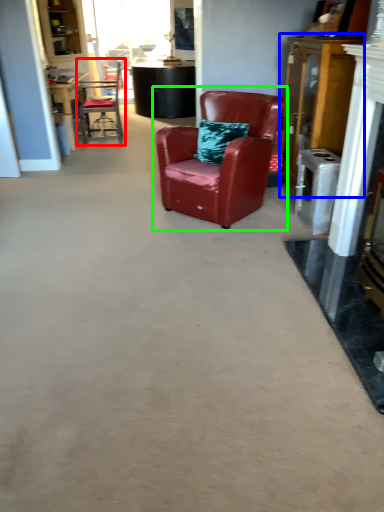
Question: Which object is the closest to the chair (highlighted by a red box)? Choose among these: dresser (highlighted by a blue box) or chair (highlighted by a green box).

Choices:
 (A) dresser
 (B) chair

Answer: (B)